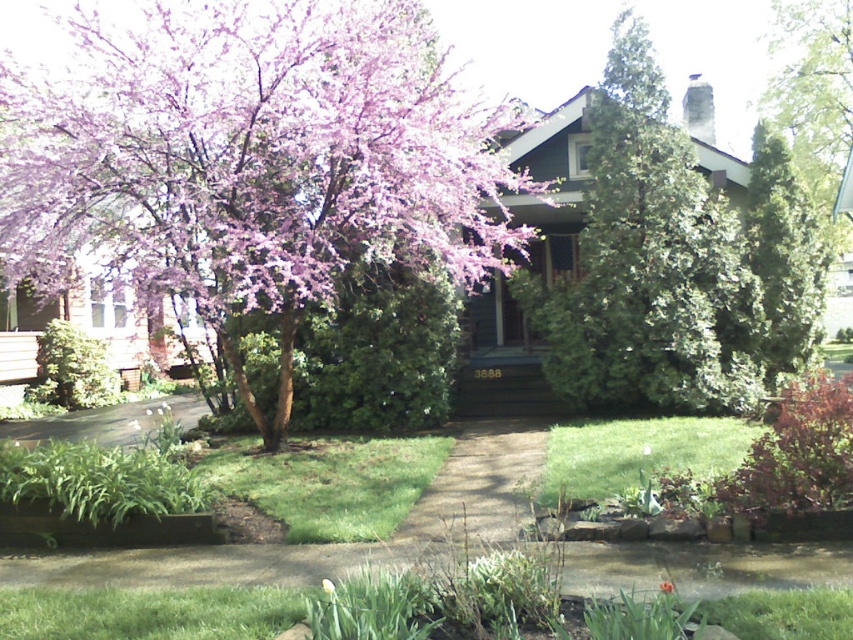
Question: Is green textured evergreen tree at upper center to the right of yellow matte flower at center from the viewer's perspective?

Choices:
 (A) yes
 (B) no

Answer: (A)

Question: Which of the following is the farthest from the observer?

Choices:
 (A) (662, 588)
 (B) (573, 394)
 (C) (793, 116)

Answer: (C)

Question: Estimate the real-world distances between objects in this image. Which object is farther from the green textured evergreen tree at right?

Choices:
 (A) yellow matte flower at center
 (B) green leafy tree at upper right
 (C) purple bloom tree at center

Answer: (A)

Question: Which point is closer to the camera?

Choices:
 (A) (666, 582)
 (B) (105, 252)
 (C) (323, 580)
 (D) (769, 227)

Answer: (A)

Question: Where is green textured evergreen tree at upper center located in relation to yellow matte flower at center in the image?

Choices:
 (A) right
 (B) left

Answer: (A)

Question: Does purple bloom tree at center lie in front of green textured evergreen tree at upper center?

Choices:
 (A) no
 (B) yes

Answer: (B)